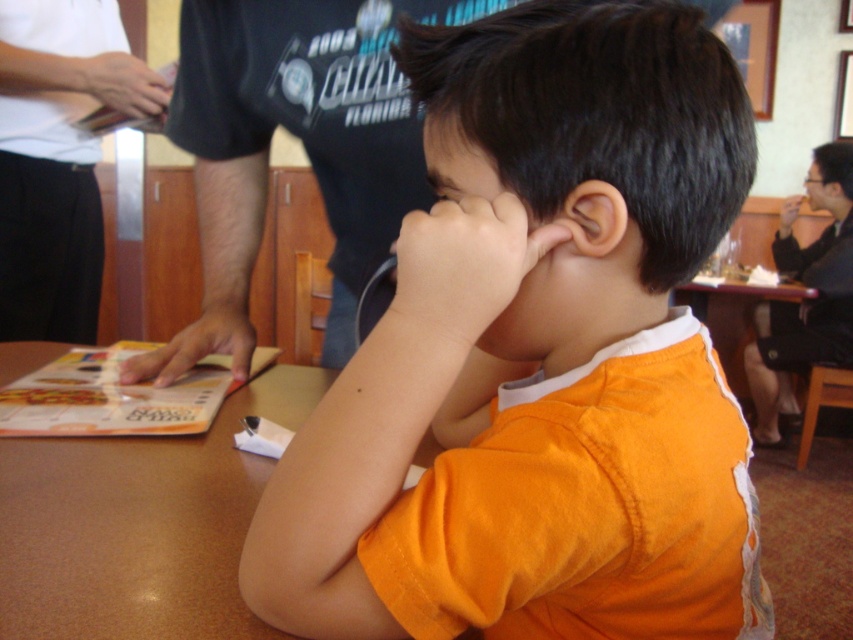
Who is shorter, orange smooth skin at ear or matte white hand at upper right?

Standing shorter between the two is orange smooth skin at ear.

Between point (456, 307) and point (779, 221), which one is positioned behind?

Point (779, 221)

You are a GUI agent. You are given a task and a screenshot of the screen. Output one action in this format:
    pyautogui.click(x=<x>, y=<y>)
    Task: Click on the orange smooth skin at ear
    Image resolution: width=853 pixels, height=640 pixels.
    Given the screenshot: What is the action you would take?
    pyautogui.click(x=463, y=266)

From the picture: Can you confirm if black glossy hair at upper right is taller than matte paper menu at lower left?

Yes, black glossy hair at upper right is taller than matte paper menu at lower left.

Which is in front, point (837, 365) or point (242, 180)?

Point (242, 180) is more forward.

Locate an element on the screen. black glossy hair at upper right is located at coordinates (811, 300).

Can you confirm if brown laminate table at lower left is wider than orange smooth skin at ear?

Indeed, brown laminate table at lower left has a greater width compared to orange smooth skin at ear.

Is point (172, 620) positioned in front of point (488, 312)?

No, (172, 620) is further to viewer.

This screenshot has height=640, width=853. Identify the location of brown laminate table at lower left. (138, 524).